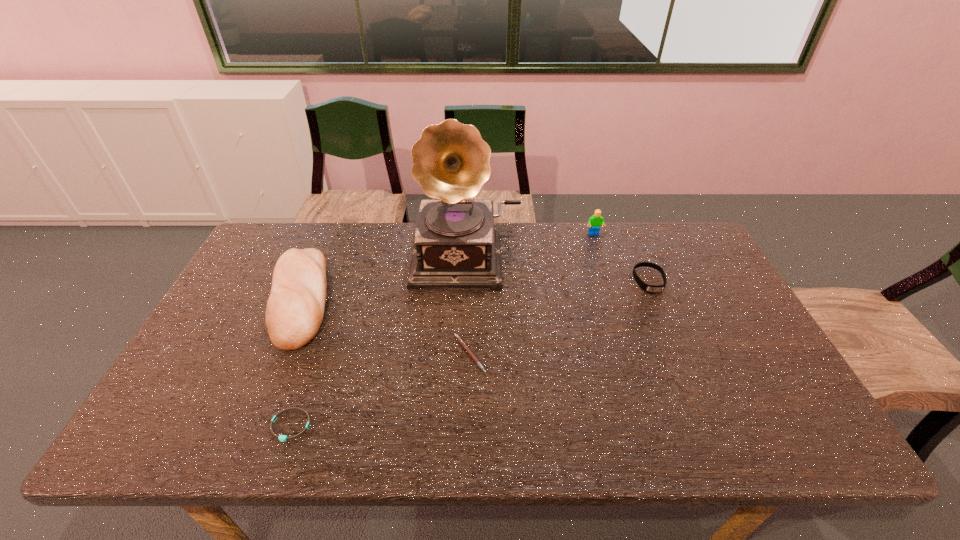
At what (x,y) coordinates should I click in order to perform the action: click on free space at the near edge of the desktop. Please return your answer as a coordinate pair (x, y). The width and height of the screenshot is (960, 540). Looking at the image, I should click on (396, 424).

This screenshot has height=540, width=960. In the image, there is a desktop. What are the coordinates of `free space at the left edge` in the screenshot? It's located at (225, 305).

In the image, there is a desktop. Where is `free space at the far left corner`? The width and height of the screenshot is (960, 540). free space at the far left corner is located at coordinates (293, 235).

I want to click on vacant space at the far right corner, so click(661, 222).

At what (x,y) coordinates should I click in order to perform the action: click on vacant space in between the taller wristband and the Lego. Please return your answer as a coordinate pair (x, y). The width and height of the screenshot is (960, 540). Looking at the image, I should click on (621, 257).

Locate an element on the screen. The width and height of the screenshot is (960, 540). vacant area that lies between the left wristband and the record player is located at coordinates (379, 342).

Locate an element on the screen. The image size is (960, 540). free space between the pen and the record player is located at coordinates (468, 306).

At what (x,y) coordinates should I click in order to perform the action: click on free space between the second shortest object and the shorter wristband. Please return your answer as a coordinate pair (x, y). The height and width of the screenshot is (540, 960). Looking at the image, I should click on (380, 390).

I want to click on vacant space that's between the fifth tallest object and the tallest object, so click(x=468, y=306).

This screenshot has width=960, height=540. In order to click on vacant area that lies between the second object from right to left and the fourth tallest object in this screenshot , I will do `click(621, 257)`.